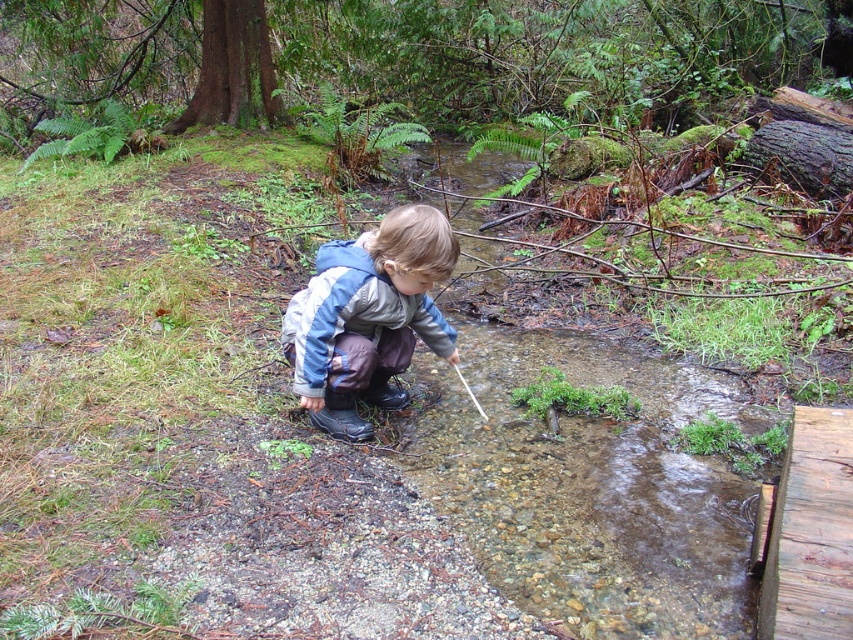
You are a photographer trying to capture the child in the center of the frame. The camera has a grid overlay with a point at coordinates (368,317). Where should you aim your camera to ensure the child is centered?

The point at coordinates (368,317) marks the blue denim jacket at center, so you should aim your camera at the blue denim jacket at center to ensure the child is centered.

You are a hiker who needs to decide whether to place your backpack on the blue denim jacket at center or the weathered wooden plank at lower right. Based on their sizes, which surface would be more stable for placing your backpack?

The blue denim jacket at center is bigger than the weathered wooden plank at lower right, so placing the backpack on the blue denim jacket at center would be more stable due to its larger surface area.

You are a hiker who has just arrived at the stream. You notice the blue denim jacket at center. Based on its position, can you estimate how far it is from the stream edge?

The blue denim jacket at center is located at point coordinates that are not provided in the scene description. Without specific distance measurements between the jacket and the stream edge, I cannot accurately estimate the distance. Please provide more details about the jacket and stream edge positions.